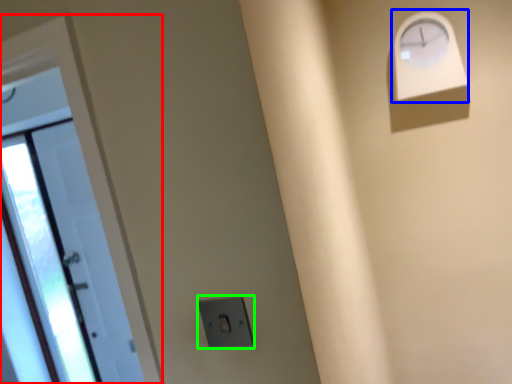
Question: Which is nearer to the door (highlighted by a red box)? clock (highlighted by a blue box) or electric outlet (highlighted by a green box).

Choices:
 (A) clock
 (B) electric outlet

Answer: (B)